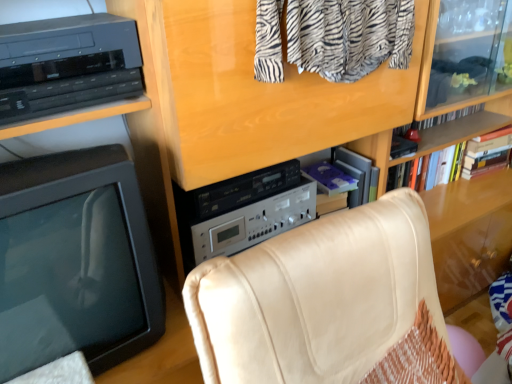
Question: Is the position of hardcover book at upper right, arranged as the 3th book when viewed from the left, more distant than that of purple matte book at center, which is the third book from right to left?

Choices:
 (A) no
 (B) yes

Answer: (B)

Question: From the image's perspective, is hardcover book at upper right, arranged as the 3th book when viewed from the left, located beneath purple matte book at center, the first book when ordered from left to right?

Choices:
 (A) no
 (B) yes

Answer: (A)

Question: Is hardcover book at upper right, arranged as the 3th book when viewed from the left, outside purple matte book at center, the first book when ordered from left to right?

Choices:
 (A) yes
 (B) no

Answer: (A)

Question: Is hardcover book at upper right, arranged as the 3th book when viewed from the left, surrounding purple matte book at center, the first book when ordered from left to right?

Choices:
 (A) no
 (B) yes

Answer: (A)

Question: Is hardcover book at upper right, positioned as the first book in right-to-left order, next to purple matte book at center, which is the third book from right to left?

Choices:
 (A) yes
 (B) no

Answer: (B)

Question: From a real-world perspective, is purple matte book at center, which is the third book from right to left, positioned above or below hardcover book at upper right, positioned as the first book in right-to-left order?

Choices:
 (A) below
 (B) above

Answer: (B)

Question: Looking at the image, does purple matte book at center, the first book when ordered from left to right, seem bigger or smaller compared to hardcover book at upper right, arranged as the 3th book when viewed from the left?

Choices:
 (A) small
 (B) big

Answer: (A)

Question: Looking at their shapes, would you say purple matte book at center, which is the third book from right to left, is wider or thinner than hardcover book at upper right, positioned as the first book in right-to-left order?

Choices:
 (A) wide
 (B) thin

Answer: (A)

Question: In the image, is purple matte book at center, which is the third book from right to left, positioned in front of or behind hardcover book at upper right, arranged as the 3th book when viewed from the left?

Choices:
 (A) behind
 (B) front

Answer: (B)

Question: Looking at their shapes, would you say purple matte book at center, the first book when ordered from left to right, is wider or thinner than purple plastic book at center right, which is the 2th book from left to right?

Choices:
 (A) thin
 (B) wide

Answer: (A)

Question: Is purple matte book at center, which is the third book from right to left, inside or outside of purple plastic book at center right, which is the 2th book from left to right?

Choices:
 (A) inside
 (B) outside

Answer: (B)

Question: Considering the positions of purple matte book at center, which is the third book from right to left, and purple plastic book at center right, which is the 2th book from left to right, in the image, is purple matte book at center, which is the third book from right to left, bigger or smaller than purple plastic book at center right, which is the 2th book from left to right,?

Choices:
 (A) small
 (B) big

Answer: (A)

Question: From the image's perspective, is purple matte book at center, the first book when ordered from left to right, above or below purple plastic book at center right, which is the 2th book from left to right?

Choices:
 (A) above
 (B) below

Answer: (A)

Question: Is point (318, 173) closer or farther from the camera than point (56, 82)?

Choices:
 (A) farther
 (B) closer

Answer: (A)

Question: Considering the positions of purple matte book at center, the first book when ordered from left to right, and black plastic shelf at upper left in the image, is purple matte book at center, the first book when ordered from left to right, taller or shorter than black plastic shelf at upper left?

Choices:
 (A) tall
 (B) short

Answer: (B)